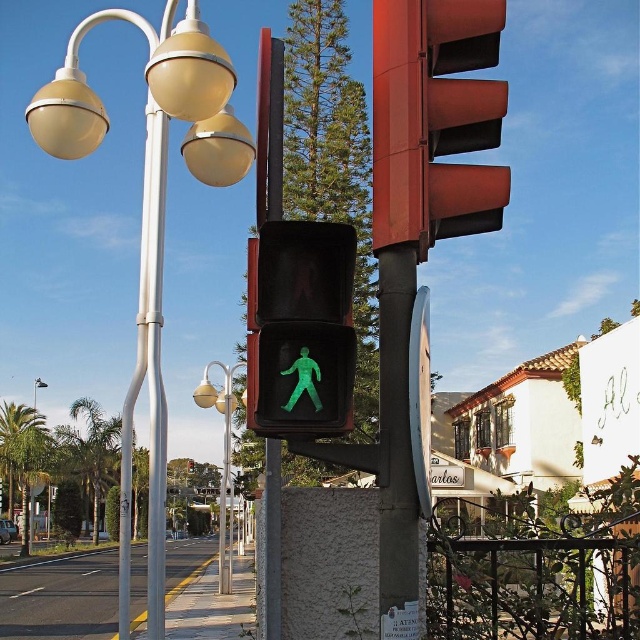
Question: Does metallic street light at center have a lesser width compared to matte yellow street light at upper left?

Choices:
 (A) no
 (B) yes

Answer: (B)

Question: Where is metallic red traffic light at upper center located in relation to green plastic pedestrian at center in the image?

Choices:
 (A) left
 (B) right

Answer: (B)

Question: Among these points, which one is nearest to the camera?

Choices:
 (A) (419, 92)
 (B) (108, 116)

Answer: (A)

Question: Can you confirm if metallic red traffic light at upper center is smaller than matte yellow street light at upper left?

Choices:
 (A) yes
 (B) no

Answer: (A)

Question: Which of the following is the closest to the observer?

Choices:
 (A) metallic red traffic light at upper center
 (B) green plastic pedestrian at center
 (C) matte yellow street light at upper left
 (D) green matte pedestrian signal at center

Answer: (B)

Question: Estimate the real-world distances between objects in this image. Which object is closer to the green plastic pedestrian at center?

Choices:
 (A) metallic red traffic light at upper center
 (B) green matte pedestrian signal at center
 (C) matte yellow street light at upper left
 (D) matte white street light at left

Answer: (A)